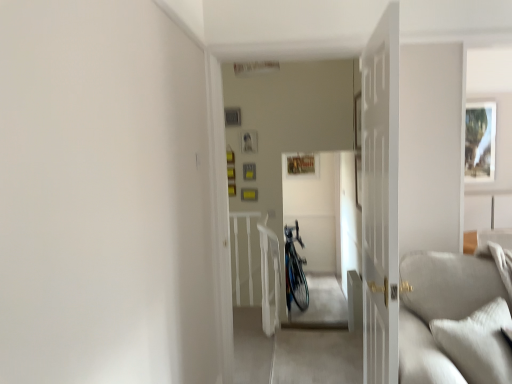
Where is `shiny metallic bicycle at center`? This screenshot has height=384, width=512. shiny metallic bicycle at center is located at coordinates (295, 270).

What do you see at coordinates (480, 141) in the screenshot? I see `matte white picture frame at upper right` at bounding box center [480, 141].

What is the approximate width of matte white picture frame at upper right?

The width of matte white picture frame at upper right is 2.56 inches.

This screenshot has height=384, width=512. In order to click on white wooden door at center in this screenshot , I will do `click(380, 200)`.

Find the location of `shiny metallic bicycle at center`. shiny metallic bicycle at center is located at coordinates point(295,270).

Based on the photo, is white wooden door at center looking in the opposite direction of shiny metallic bicycle at center?

That's not correct — white wooden door at center is not looking away from shiny metallic bicycle at center.

At what (x,y) coordinates should I click in order to perform the action: click on door above the shiny metallic bicycle at center (from the image's perspective). Please return your answer as a coordinate pair (x, y). Looking at the image, I should click on (380, 200).

Does white wooden door at center touch shiny metallic bicycle at center?

No, white wooden door at center is not in contact with shiny metallic bicycle at center.

Considering the relative sizes of white wooden door at center and shiny metallic bicycle at center in the image provided, is white wooden door at center thinner than shiny metallic bicycle at center?

Indeed, white wooden door at center has a lesser width compared to shiny metallic bicycle at center.

Between light gray corduroy couch at lower right and white wooden door at center, which one has smaller width?

With smaller width is white wooden door at center.

Is light gray corduroy couch at lower right looking in the opposite direction of white wooden door at center?

Yes, white wooden door at center is at the back of light gray corduroy couch at lower right.

Is light gray corduroy couch at lower right positioned beyond the bounds of white wooden door at center?

light gray corduroy couch at lower right is positioned outside white wooden door at center.

Based on the photo, does light gray corduroy couch at lower right have a larger size compared to white wooden door at center?

Incorrect, light gray corduroy couch at lower right is not larger than white wooden door at center.

Considering the relative positions of shiny metallic bicycle at center and white wooden door at center in the image provided, is shiny metallic bicycle at center behind white wooden door at center?

Yes, it is behind white wooden door at center.

From the image's perspective, which is above, shiny metallic bicycle at center or white wooden door at center?

white wooden door at center.

Identify the location of bicycle below the white wooden door at center (from the image's perspective). (295, 270).

Based on the photo, is shiny metallic bicycle at center next to white wooden door at center?

shiny metallic bicycle at center is not next to white wooden door at center, and they're not touching.

Is white wooden door at center inside the boundaries of matte white picture frame at upper right, or outside?

white wooden door at center exists outside the volume of matte white picture frame at upper right.

Is white wooden door at center touching matte white picture frame at upper right?

white wooden door at center and matte white picture frame at upper right are not in contact.

Is white wooden door at center behind matte white picture frame at upper right?

That is False.

Based on their sizes in the image, would you say white wooden door at center is bigger or smaller than matte white picture frame at upper right?

In the image, white wooden door at center appears to be larger than matte white picture frame at upper right.

Is point (287, 299) more distant than point (471, 146)?

No, it is in front of (471, 146).

From the image's perspective, relative to matte white picture frame at upper right, is shiny metallic bicycle at center above or below?

From the image's perspective, shiny metallic bicycle at center appears below matte white picture frame at upper right.

Considering the relative sizes of shiny metallic bicycle at center and matte white picture frame at upper right in the image provided, is shiny metallic bicycle at center bigger than matte white picture frame at upper right?

Yes, shiny metallic bicycle at center is bigger than matte white picture frame at upper right.

Which object is positioned more to the left, shiny metallic bicycle at center or matte white picture frame at upper right?

Positioned to the left is shiny metallic bicycle at center.

How far apart are light gray corduroy couch at lower right and matte white picture frame at upper right?

The distance of light gray corduroy couch at lower right from matte white picture frame at upper right is 3.78 meters.

I want to click on picture frame positioned vertically above the light gray corduroy couch at lower right (from a real-world perspective), so click(480, 141).

Based on their positions, is light gray corduroy couch at lower right located to the left or right of matte white picture frame at upper right?

From the image, it's evident that light gray corduroy couch at lower right is to the left of matte white picture frame at upper right.

Is light gray corduroy couch at lower right located outside matte white picture frame at upper right?

Absolutely, light gray corduroy couch at lower right is external to matte white picture frame at upper right.

Could you tell me if matte white picture frame at upper right is facing shiny metallic bicycle at center?

No, matte white picture frame at upper right is not oriented towards shiny metallic bicycle at center.

From the image's perspective, is matte white picture frame at upper right located above or below shiny metallic bicycle at center?

Based on their image positions, matte white picture frame at upper right is located above shiny metallic bicycle at center.

From a real-world perspective, does matte white picture frame at upper right sit lower than shiny metallic bicycle at center?

No.

This screenshot has width=512, height=384. I want to click on door in front of the shiny metallic bicycle at center, so click(380, 200).

The height and width of the screenshot is (384, 512). Find the location of `door located above the light gray corduroy couch at lower right (from a real-world perspective)`. door located above the light gray corduroy couch at lower right (from a real-world perspective) is located at coordinates (380, 200).

Considering their positions, is white wooden door at center positioned closer to matte white picture frame at upper right than light gray corduroy couch at lower right?

Based on the image, light gray corduroy couch at lower right appears to be nearer to matte white picture frame at upper right.

When comparing their distances from shiny metallic bicycle at center, does light gray corduroy couch at lower right or matte white picture frame at upper right seem closer?

light gray corduroy couch at lower right is closer to shiny metallic bicycle at center.

When comparing their distances from light gray corduroy couch at lower right, does white wooden door at center or shiny metallic bicycle at center seem closer?

Based on the image, white wooden door at center appears to be nearer to light gray corduroy couch at lower right.

When comparing their distances from shiny metallic bicycle at center, does matte white picture frame at upper right or white wooden door at center seem further?

matte white picture frame at upper right lies further to shiny metallic bicycle at center than the other object.

Looking at the image, which one is located further to white wooden door at center, matte white picture frame at upper right or shiny metallic bicycle at center?

matte white picture frame at upper right lies further to white wooden door at center than the other object.

Which object lies further to the anchor point white wooden door at center, light gray corduroy couch at lower right or shiny metallic bicycle at center?

The object further to white wooden door at center is shiny metallic bicycle at center.

Looking at the image, which one is located further to white wooden door at center, shiny metallic bicycle at center or light gray corduroy couch at lower right?

shiny metallic bicycle at center lies further to white wooden door at center than the other object.

Based on the photo, looking at the image, which one is located closer to light gray corduroy couch at lower right, shiny metallic bicycle at center or white wooden door at center?

Among the two, white wooden door at center is located nearer to light gray corduroy couch at lower right.

The width and height of the screenshot is (512, 384). In order to click on picture frame between light gray corduroy couch at lower right and shiny metallic bicycle at center from front to back in this screenshot , I will do `click(480, 141)`.

At what (x,y) coordinates should I click in order to perform the action: click on picture frame located between white wooden door at center and shiny metallic bicycle at center in the depth direction. Please return your answer as a coordinate pair (x, y). Image resolution: width=512 pixels, height=384 pixels. Looking at the image, I should click on (480, 141).

The width and height of the screenshot is (512, 384). In order to click on couch between white wooden door at center and matte white picture frame at upper right from front to back in this screenshot , I will do `click(448, 319)`.

Locate an element on the screen. couch between white wooden door at center and shiny metallic bicycle at center in the front-back direction is located at coordinates (448, 319).